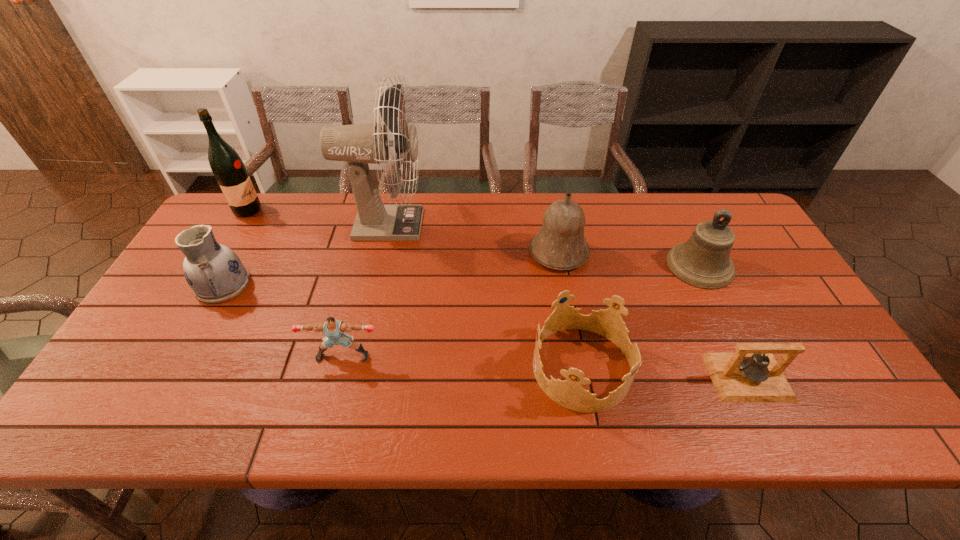
Locate an element on the screen. The image size is (960, 540). vacant space situated 0.210m on the front of the leftmost bell is located at coordinates (573, 333).

Identify the location of free space located 0.190m on the back of the pottery. (256, 224).

Where is `blank space located 0.280m on the front-facing side of the tiara`? blank space located 0.280m on the front-facing side of the tiara is located at coordinates (415, 368).

Where is `vacant space located 0.050m on the front-facing side of the tiara`? The height and width of the screenshot is (540, 960). vacant space located 0.050m on the front-facing side of the tiara is located at coordinates (512, 368).

Identify the location of free space located 0.060m on the front-facing side of the tiara. The image size is (960, 540). (508, 368).

Locate an element on the screen. The image size is (960, 540). vacant region located on the front-facing side of the puncher is located at coordinates (336, 386).

Identify the location of vacant area located 0.190m on the left of the nearest bell. (629, 377).

In order to click on fan that is at the far edge in this screenshot , I will do `click(359, 144)`.

I want to click on liquor that is at the far edge, so click(x=229, y=170).

Find the location of a particular element. bell positioned at the far edge is located at coordinates (560, 244).